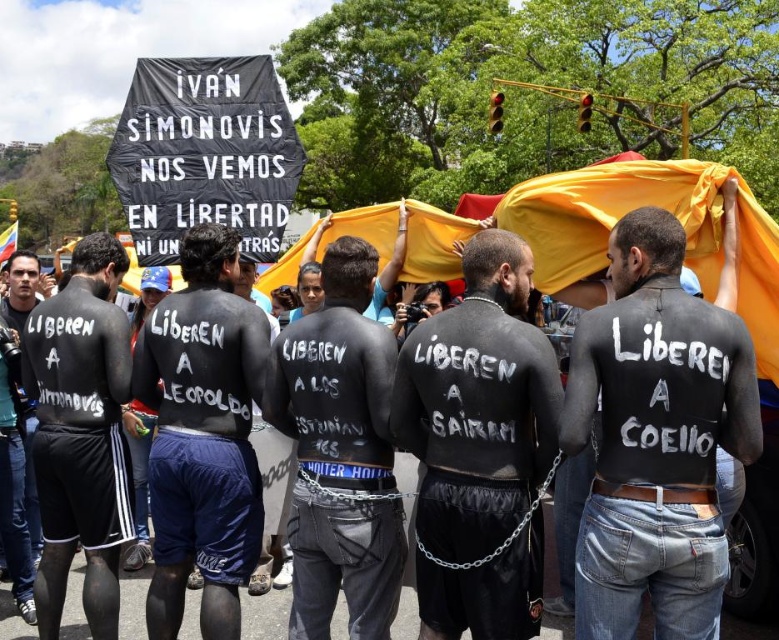
Question: Does black matte body paint at center appear over black painted skin at center?

Choices:
 (A) no
 (B) yes

Answer: (B)

Question: Which object is positioned closest to the black matte shorts at lower left?

Choices:
 (A) black matte body at center
 (B) black matte body paint at center
 (C) black painted skin at center

Answer: (C)

Question: Which of the following is the closest to the observer?

Choices:
 (A) click(x=288, y=328)
 (B) click(x=520, y=540)
 (C) click(x=672, y=440)

Answer: (C)

Question: Is black painted skin at center further to the viewer compared to black matte shorts at lower left?

Choices:
 (A) no
 (B) yes

Answer: (A)

Question: Is black painted skin at center below black matte shorts at lower left?

Choices:
 (A) no
 (B) yes

Answer: (B)

Question: Which point appears farthest from the camera in this image?

Choices:
 (A) (621, 481)
 (B) (496, 627)

Answer: (A)